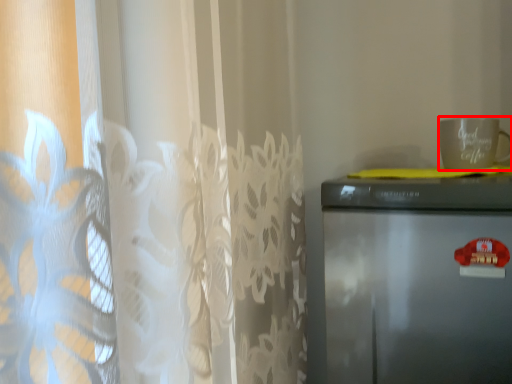
Question: From the image's perspective, where is mug (annotated by the red box) located in relation to refrigerator in the image?

Choices:
 (A) above
 (B) below

Answer: (A)